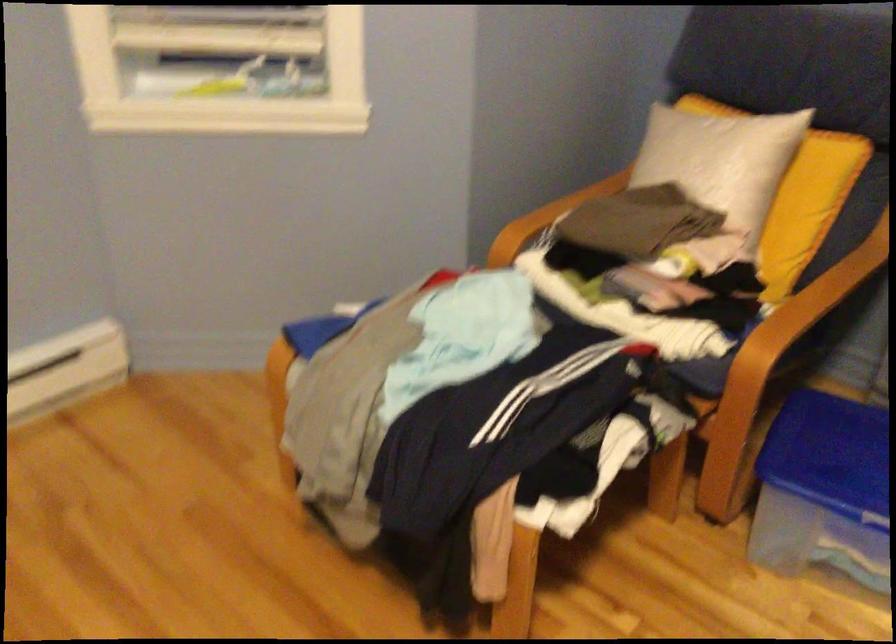
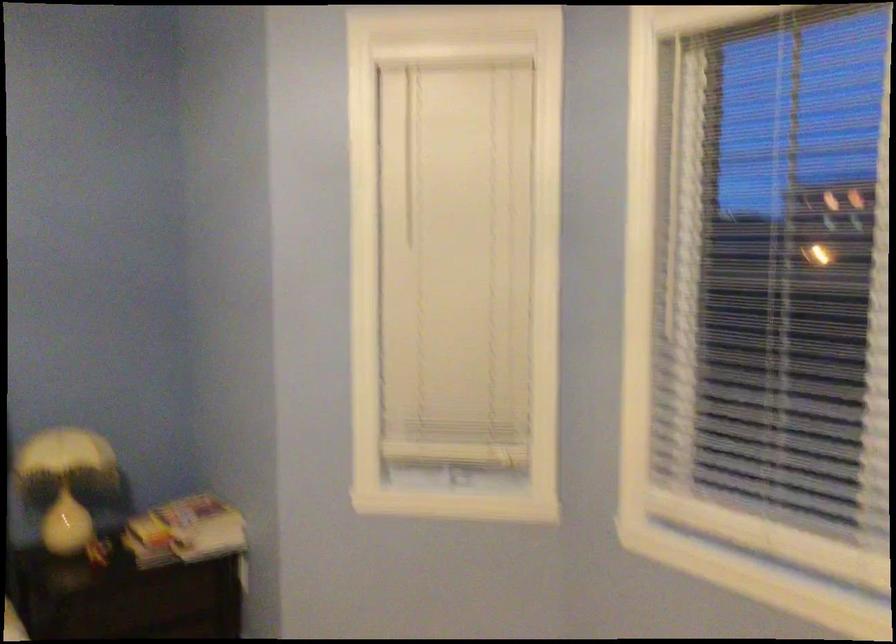
Question: Based on the continuous images, in which direction is the camera rotating? Reply with the corresponding letter.

Choices:
 (A) Left
 (B) Right
 (C) Up
 (D) Down

Answer: (A)